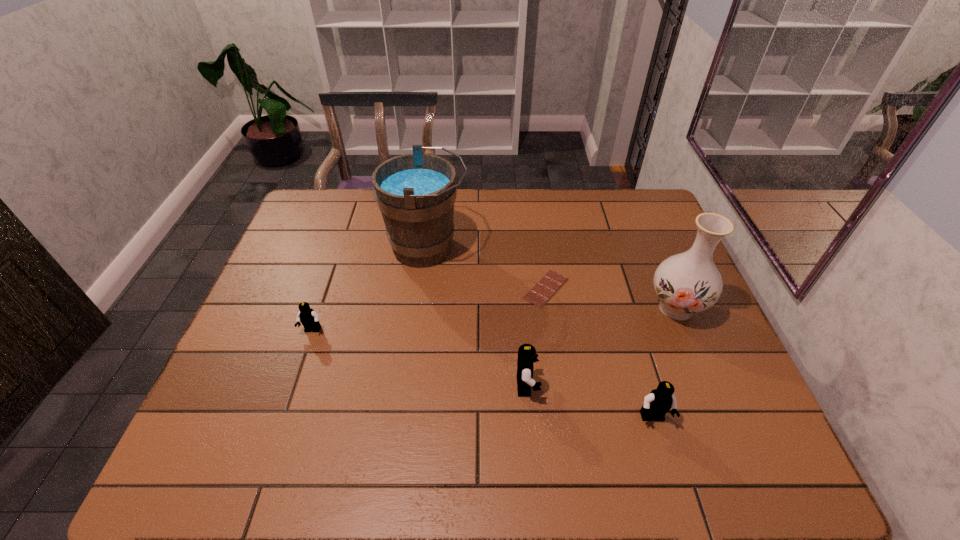
This screenshot has width=960, height=540. What are the coordinates of `vacant area between the chocolate bar and the fifth tallest object` in the screenshot? It's located at (429, 309).

At what (x,y) coordinates should I click in order to perform the action: click on free space between the wine bucket and the rightmost Lego. Please return your answer as a coordinate pair (x, y). The image size is (960, 540). Looking at the image, I should click on (540, 333).

This screenshot has height=540, width=960. What are the coordinates of `vacant point located between the fifth farthest object and the vase` in the screenshot? It's located at [601, 347].

Locate an element on the screen. object that is the second closest one to the shortest object is located at coordinates (527, 355).

Image resolution: width=960 pixels, height=540 pixels. Find the location of `object that is the fifth closest to the wine bucket`. object that is the fifth closest to the wine bucket is located at coordinates (656, 404).

This screenshot has height=540, width=960. What are the coordinates of `the closest Lego to the leftmost object` in the screenshot? It's located at (527, 355).

Identify which Lego is the closest to the fifth object from left to right. Please provide its 2D coordinates. Your answer should be formatted as a tuple, i.e. [(x, y)], where the tuple contains the x and y coordinates of a point satisfying the conditions above.

[(527, 355)]

The image size is (960, 540). In order to click on vacant area that satisfies the following two spatial constraints: 1. with a handle on the side of the chocolate bar; 2. on the left side of the wine bucket in this screenshot , I will do `click(422, 288)`.